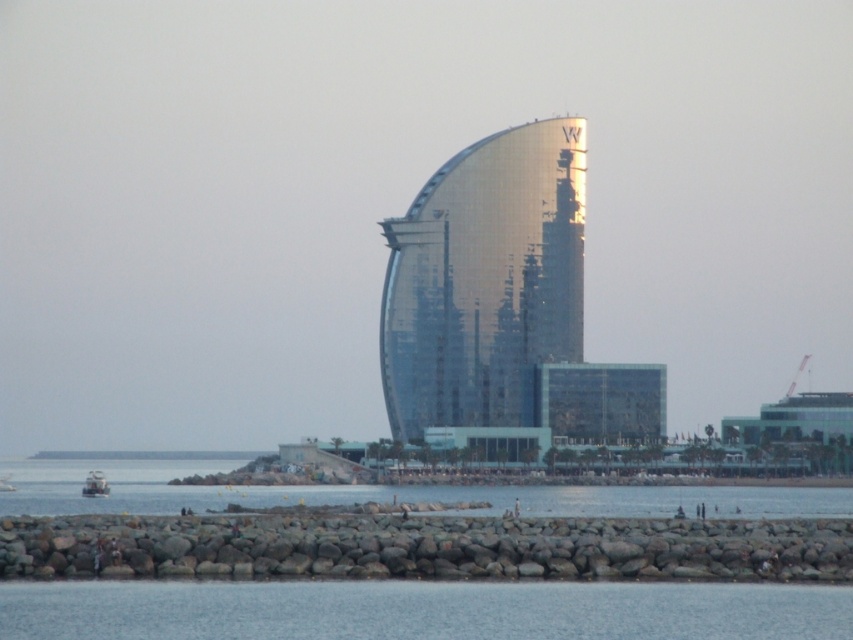
You are standing at the point marked as point (482, 358) and want to take a photo of the W Barcelona Hotel. Since you are 647.10 meters away from the viewer, will you be able to capture the entire hotel in your shot?

The point (482, 358) is 647.10 meters away from the viewer. Since the distance is quite large, it is possible to capture the entire hotel in the photo if your camera has a wide enough lens. However, without a wide angle lens, capturing the entire structure might be challenging due to the distance.